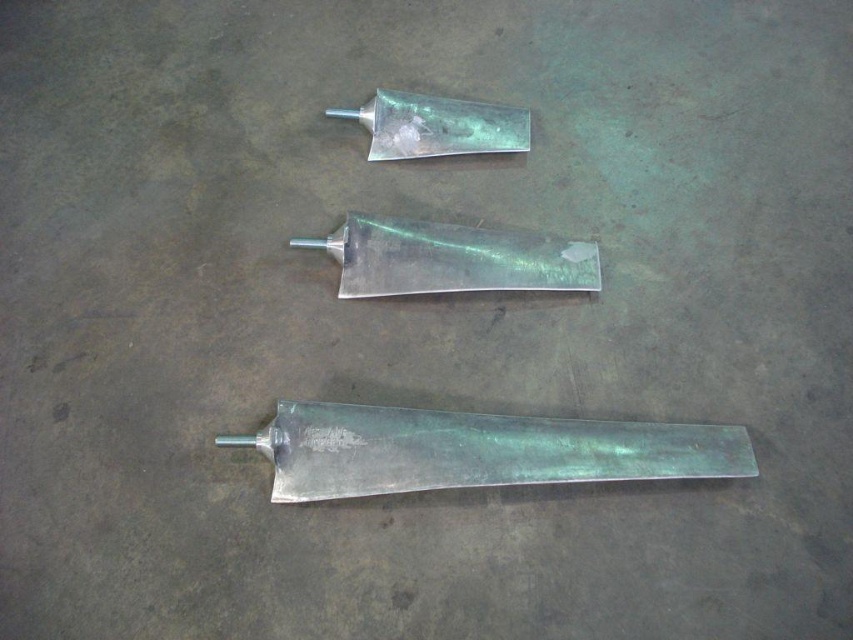
You are a warehouse worker who needs to move the shiny silver razor at center to a higher shelf. Can you lift it directly without moving the metallic silver razor at bottom first?

The metallic silver razor at bottom is positioned under the shiny silver razor at center, so you cannot lift the shiny silver razor at center directly without moving the metallic silver razor at bottom first.

You are an inspector checking the arrangement of tools on the floor. You see the metallic silver razor at bottom and the metallic silver razor at center. Which one is positioned lower in the image?

The metallic silver razor at bottom is located below the metallic silver razor at center, so it is positioned lower in the image.

You are standing on the concrete floor and see the point marked at coordinates (451, 259). What object is located exactly at that point?

The point marked at coordinates (451, 259) is exactly where the metallic silver razor at center is located.